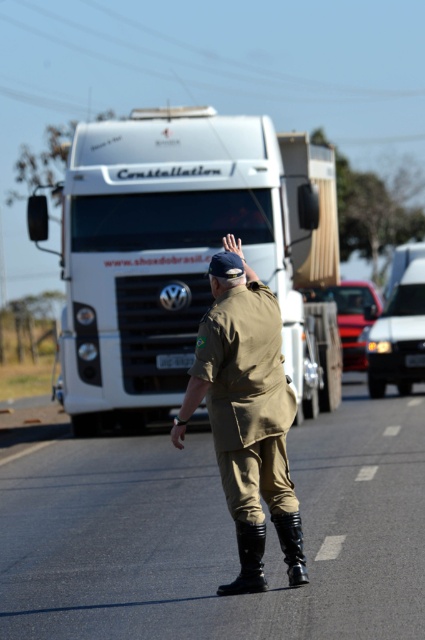
Image resolution: width=425 pixels, height=640 pixels. What do you see at coordinates (189, 253) in the screenshot?
I see `white glossy truck at center` at bounding box center [189, 253].

Who is positioned more to the left, white glossy truck at center or khaki uniform at center?

white glossy truck at center is more to the left.

Between point (138, 413) and point (232, 333), which one is positioned in front?

Point (232, 333)

You are a GUI agent. You are given a task and a screenshot of the screen. Output one action in this format:
    pyautogui.click(x=<x>, y=<y>)
    Task: Click on the white glossy truck at center
    Image resolution: width=425 pixels, height=640 pixels.
    Given the screenshot: What is the action you would take?
    pyautogui.click(x=189, y=253)

Describe the element at coordinates (218, 534) in the screenshot. I see `black rubber boots at center` at that location.

Measure the distance between black rubber boots at center and camera.

black rubber boots at center is 6.14 meters from camera.

Find the location of a particular element. This screenshot has width=425, height=640. black rubber boots at center is located at coordinates (218, 534).

Is black leather boot at center below black leather boot at lower center?

Yes.

Is black leather boot at center smaller than black leather boot at lower center?

Incorrect, black leather boot at center is not smaller in size than black leather boot at lower center.

Identify the location of black leather boot at center. The image size is (425, 640). [x=248, y=561].